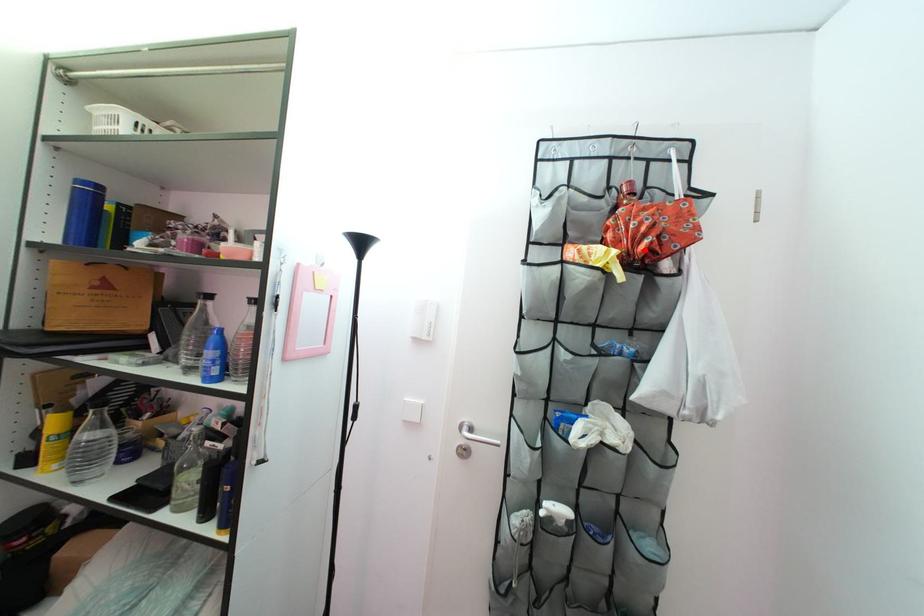
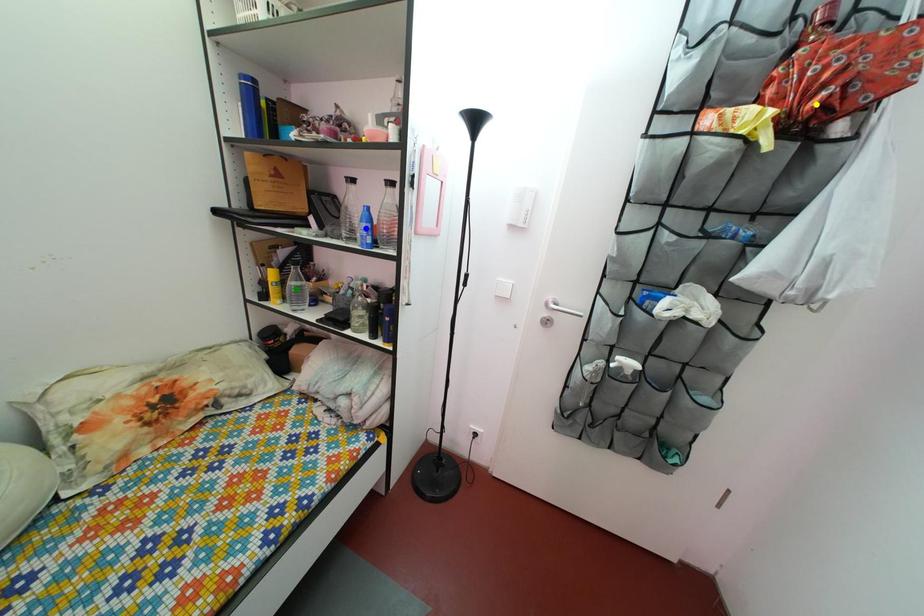
Question: I am providing you with two images of the same scene from different viewpoints. A red point is marked on the first image. You are given multiple points on the second image. In image 2, which mark is for the same physical point as the one in image 1?

Choices:
 (A) yellow point
 (B) green point
 (C) blue point

Answer: (A)